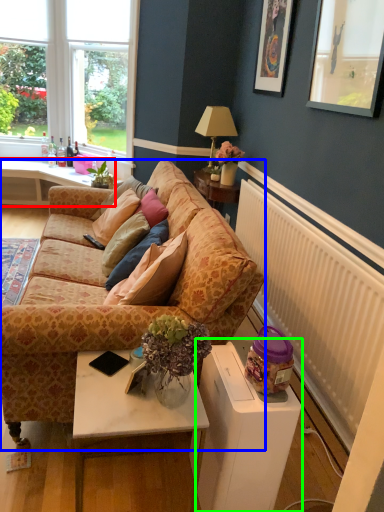
Question: Which is farther away from desk (highlighted by a red box)? studio couch (highlighted by a blue box) or wide (highlighted by a green box)?

Choices:
 (A) studio couch
 (B) wide

Answer: (B)